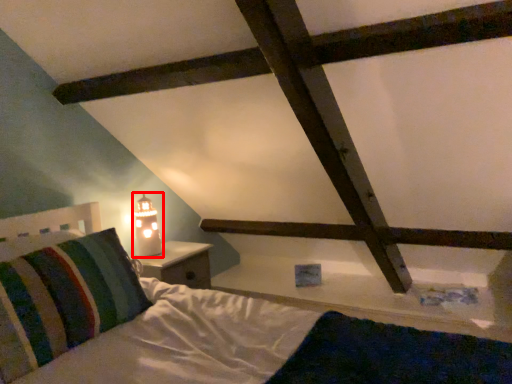
Question: From the image's perspective, where is table lamp (annotated by the red box) located in relation to pillow in the image?

Choices:
 (A) below
 (B) above

Answer: (B)